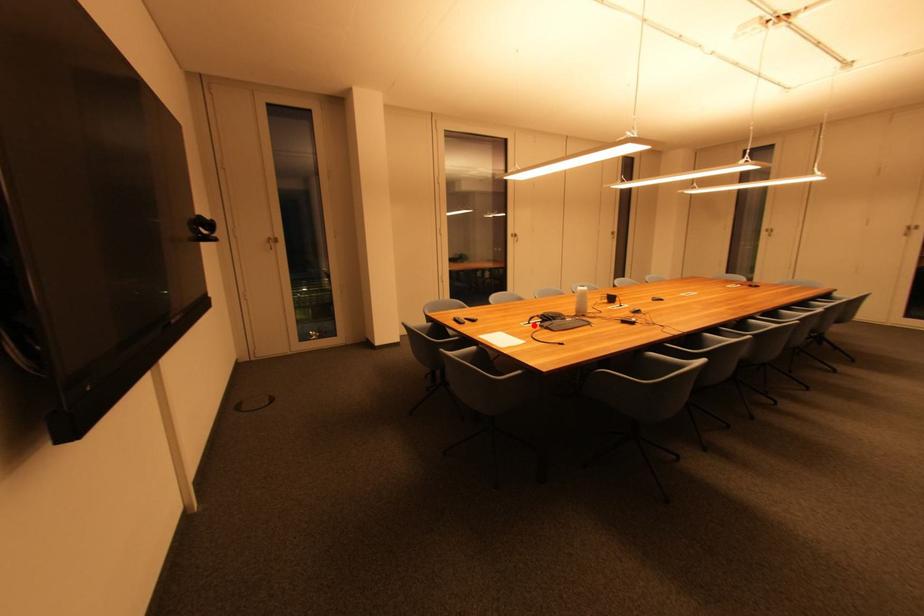
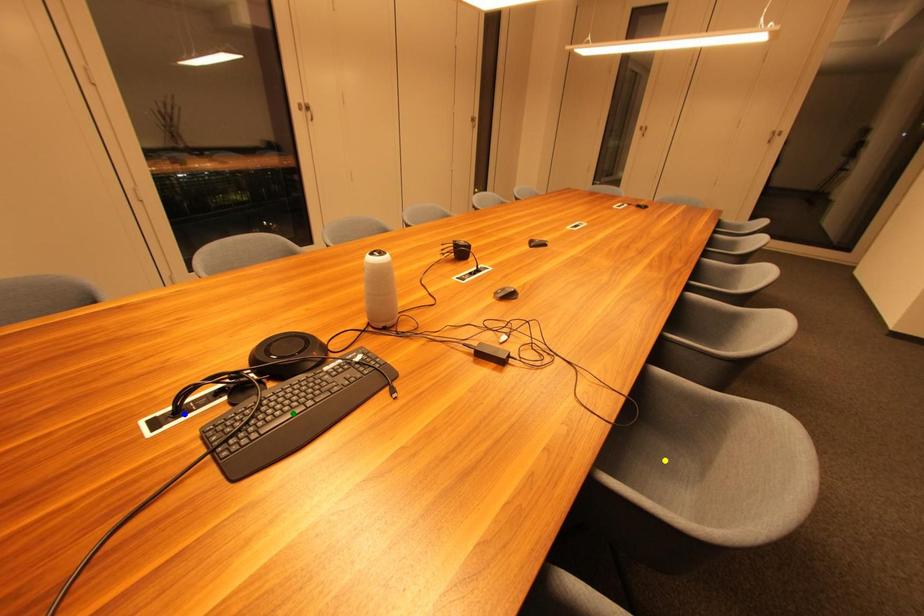
Question: I am providing you with two images of the same scene from different viewpoints. A red point is marked on the first image. You are given multiple points on the second image. Which point in image 2 is actually the same real-world point as the red point in image 1?

Choices:
 (A) green point
 (B) yellow point
 (C) blue point

Answer: (C)